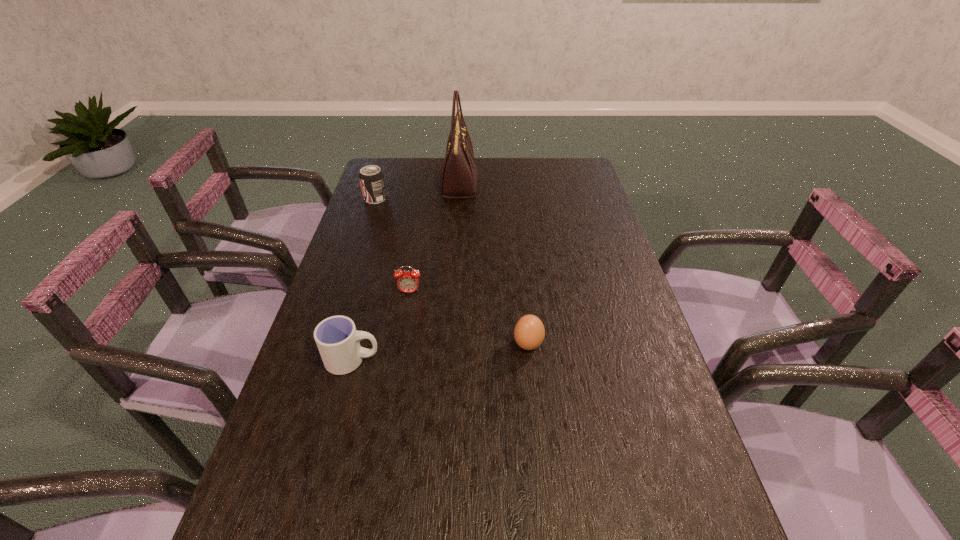
You are a GUI agent. You are given a task and a screenshot of the screen. Output one action in this format:
    pyautogui.click(x=<x>, y=<y>)
    Task: Click on the third object from right to left
    The width and height of the screenshot is (960, 540).
    Given the screenshot: What is the action you would take?
    pyautogui.click(x=458, y=177)

This screenshot has width=960, height=540. What are the coordinates of `the tallest object` in the screenshot? It's located at (458, 177).

What are the coordinates of `soda can` in the screenshot? It's located at (371, 177).

Image resolution: width=960 pixels, height=540 pixels. In order to click on cup in this screenshot , I will do `click(337, 339)`.

At what (x,y) coordinates should I click in order to perform the action: click on boiled egg. Please return your answer as a coordinate pair (x, y). The image size is (960, 540). Looking at the image, I should click on (529, 332).

At what (x,y) coordinates should I click in order to perform the action: click on the third farthest object. Please return your answer as a coordinate pair (x, y). This screenshot has height=540, width=960. Looking at the image, I should click on (408, 282).

I want to click on alarm clock, so click(x=408, y=282).

The image size is (960, 540). I want to click on free space located on the front-facing side of the fourth object from left to right, so click(504, 183).

This screenshot has height=540, width=960. Identify the location of free spot located on the front of the soda can. (351, 271).

This screenshot has height=540, width=960. I want to click on vacant space located 0.400m with the handle on the side of the cup, so pos(549,360).